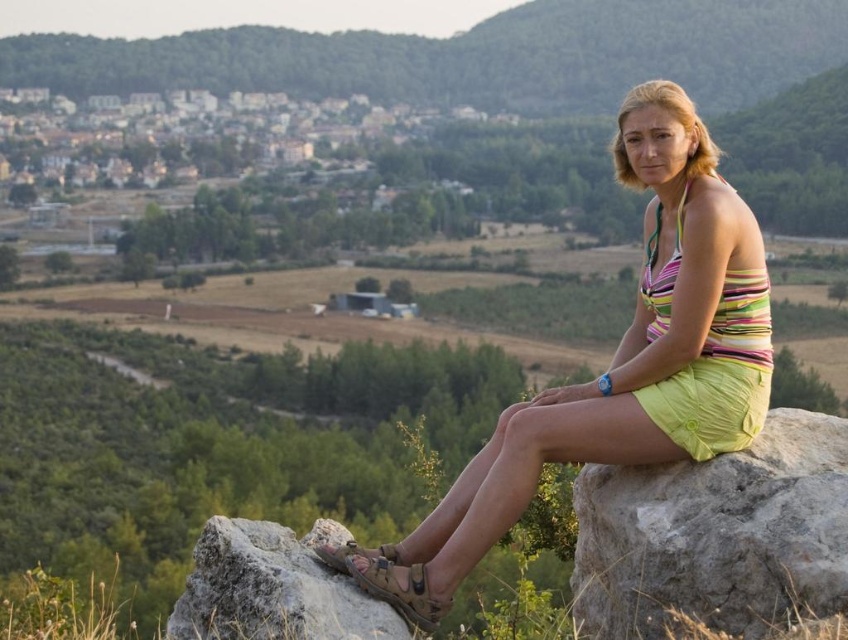
You are a photographer trying to capture the woman in the image. You want to focus on her green fabric shorts at lower right. Where should you aim your camera to ensure the point at coordinates point [717,534] is in the frame?

You should aim your camera at the green fabric shorts at lower right since the point [717,534] is located there.

You are a photographer planning to capture the rough textured rock at lower left and the brown leather sandal at lower center in a single frame. Since you want both objects to be clearly visible, which object should you focus on to ensure it takes up more space in the photo?

The rough textured rock at lower left should be focused on because it is bigger than the brown leather sandal at lower center, so it will naturally take up more space in the photo.